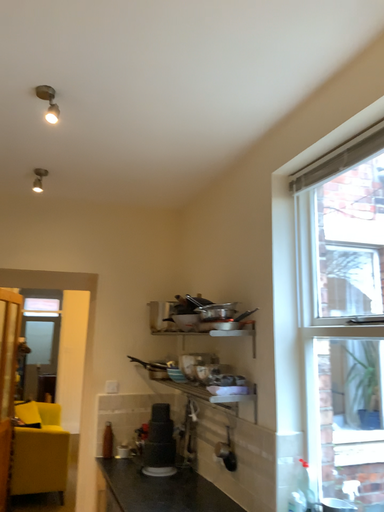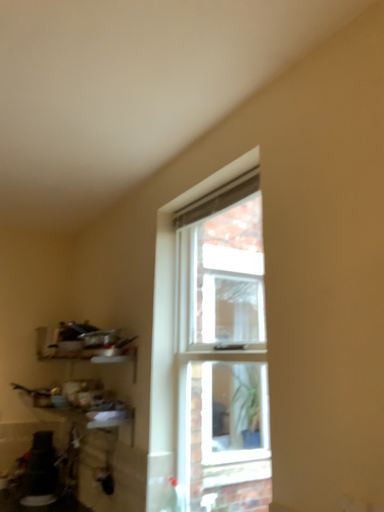
Question: Which way did the camera rotate in the video?

Choices:
 (A) rotated right
 (B) rotated left

Answer: (A)